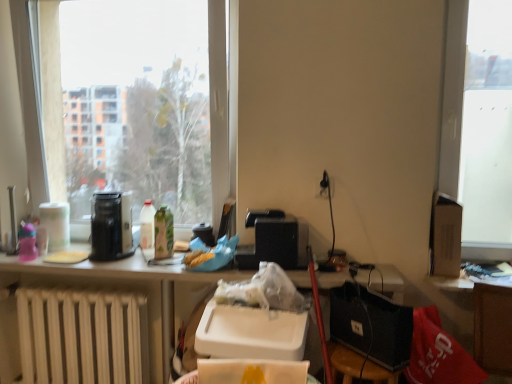
What do you see at coordinates (111, 226) in the screenshot? This screenshot has width=512, height=384. I see `matte black coffee maker at left, which ranks as the 2th appliance in right-to-left order` at bounding box center [111, 226].

Where is `green matte bottle at center, which appears as the 2th bottle when viewed from the left`? Image resolution: width=512 pixels, height=384 pixels. green matte bottle at center, which appears as the 2th bottle when viewed from the left is located at coordinates (163, 233).

Find the location of a particular element. This screenshot has height=384, width=512. wooden stool at lower right is located at coordinates (389, 330).

The height and width of the screenshot is (384, 512). In order to click on matte black coffee maker at center, which is counted as the second appliance, starting from the left in this screenshot , I will do `click(204, 234)`.

The width and height of the screenshot is (512, 384). In order to click on matte cardboard box at upper right in this screenshot , I will do click(445, 236).

The width and height of the screenshot is (512, 384). What do you see at coordinates (147, 225) in the screenshot?
I see `white glossy bottle at center, positioned as the 1th bottle in left-to-right order` at bounding box center [147, 225].

Locate an element on the screen. The height and width of the screenshot is (384, 512). matte black coffee maker at left, positioned as the first appliance in left-to-right order is located at coordinates (111, 226).

Between black plastic speaker at center and white matte radiator at lower left, which one has more height?

Standing taller between the two is white matte radiator at lower left.

How distant is black plastic speaker at center from white matte radiator at lower left?

36.17 inches.

From the image's perspective, which is above, black plastic speaker at center or white matte radiator at lower left?

From the image's view, black plastic speaker at center is above.

Is black plastic speaker at center positioned in front of white matte radiator at lower left?

That is True.

Who is bigger, matte black coffee maker at left, positioned as the first appliance in left-to-right order, or white matte radiator at lower left?

white matte radiator at lower left is bigger.

Considering the sizes of matte black coffee maker at left, which ranks as the 2th appliance in right-to-left order, and white matte radiator at lower left in the image, is matte black coffee maker at left, which ranks as the 2th appliance in right-to-left order, wider or thinner than white matte radiator at lower left?

Considering their sizes, matte black coffee maker at left, which ranks as the 2th appliance in right-to-left order, looks broader than white matte radiator at lower left.

Considering the points (130, 231) and (125, 295), which point is behind, point (130, 231) or point (125, 295)?

The point (130, 231) is more distant.

Does matte black coffee maker at left, positioned as the first appliance in left-to-right order, have a greater height compared to white matte radiator at lower left?

No, matte black coffee maker at left, positioned as the first appliance in left-to-right order, is not taller than white matte radiator at lower left.

Is wooden stool at lower right to the left of black plastic speaker at center from the viewer's perspective?

No, wooden stool at lower right is not to the left of black plastic speaker at center.

How many degrees apart are the facing directions of wooden stool at lower right and black plastic speaker at center?

wooden stool at lower right and black plastic speaker at center are facing 1.95 degrees away from each other.

From a real-world perspective, is wooden stool at lower right positioned above or below black plastic speaker at center?

Clearly, from a real-world perspective, wooden stool at lower right is below black plastic speaker at center.

Is wooden stool at lower right facing away from black plastic speaker at center?

wooden stool at lower right does not have its back to black plastic speaker at center.

From the image's perspective, which is above, black plastic speaker at center or wooden stool at lower right?

black plastic speaker at center appears higher in the image.

Consider the image. From a real-world perspective, is black plastic speaker at center over wooden stool at lower right?

Yes.

Is wooden stool at lower right inside black plastic speaker at center?

No, wooden stool at lower right is not surrounded by black plastic speaker at center.

Image resolution: width=512 pixels, height=384 pixels. I want to click on chair that appears on the right of black plastic speaker at center, so point(389,330).

Is transparent glass window at upper left wider than white matte radiator at lower left?

Yes.

Which of these two, transparent glass window at upper left or white matte radiator at lower left, is smaller?

With smaller size is white matte radiator at lower left.

Locate an element on the screen. radiator that is under the transparent glass window at upper left (from a real-world perspective) is located at coordinates [x=82, y=337].

Looking at this image, is transparent glass window at upper left in contact with white matte radiator at lower left?

No, transparent glass window at upper left is not touching white matte radiator at lower left.

Measure the distance from wooden stool at lower right to matte black coffee maker at left, positioned as the first appliance in left-to-right order.

wooden stool at lower right and matte black coffee maker at left, positioned as the first appliance in left-to-right order, are 3.60 feet apart.

Based on the photo, can you tell me how much wooden stool at lower right and matte black coffee maker at left, which ranks as the 2th appliance in right-to-left order, differ in facing direction?

There is a 1.46-degree angle between the facing directions of wooden stool at lower right and matte black coffee maker at left, which ranks as the 2th appliance in right-to-left order.

Is point (361, 305) positioned after point (99, 226)?

That is False.

From a real-world perspective, is wooden stool at lower right positioned above or below matte black coffee maker at left, which ranks as the 2th appliance in right-to-left order?

wooden stool at lower right is situated lower than matte black coffee maker at left, which ranks as the 2th appliance in right-to-left order, in the real world.

Is matte black coffee maker at left, which ranks as the 2th appliance in right-to-left order, looking in the opposite direction of wooden stool at lower right?

That's not correct — matte black coffee maker at left, which ranks as the 2th appliance in right-to-left order, is not looking away from wooden stool at lower right.

Identify the location of chair that is under the matte black coffee maker at left, which ranks as the 2th appliance in right-to-left order (from a real-world perspective). (389, 330).

Which object is positioned more to the right, matte black coffee maker at left, which ranks as the 2th appliance in right-to-left order, or wooden stool at lower right?

wooden stool at lower right.

The width and height of the screenshot is (512, 384). What are the coordinates of `radiator below the black plastic speaker at center (from a real-world perspective)` in the screenshot? It's located at (82, 337).

At what (x,y) coordinates should I click in order to perform the action: click on appliance in front of the white matte radiator at lower left. Please return your answer as a coordinate pair (x, y). Looking at the image, I should click on (111, 226).

Looking at the image, which one is located closer to black plastic speaker at center, white glossy bottle at center, positioned as the 1th bottle in left-to-right order, or matte black coffee maker at center, which is the first appliance in right-to-left order?

matte black coffee maker at center, which is the first appliance in right-to-left order, is positioned closer to the anchor black plastic speaker at center.

Estimate the real-world distances between objects in this image. Which object is further from matte black coffee maker at center, which is the first appliance in right-to-left order, wooden stool at lower right or green matte bottle at center, which appears as the 2th bottle when viewed from the left?

wooden stool at lower right is positioned further to the anchor matte black coffee maker at center, which is the first appliance in right-to-left order.

Looking at the image, which one is located closer to white matte radiator at lower left, matte black coffee maker at left, positioned as the first appliance in left-to-right order, or matte black coffee maker at center, which is the first appliance in right-to-left order?

Among the two, matte black coffee maker at left, positioned as the first appliance in left-to-right order, is located nearer to white matte radiator at lower left.

When comparing their distances from wooden stool at lower right, does transparent glass window at upper left or green matte bottle at center, which appears as the 2th bottle when viewed from the left, seem further?

transparent glass window at upper left.

From the picture: Which object lies further to the anchor point matte black coffee maker at center, which is counted as the second appliance, starting from the left, white glossy bottle at center, placed as the second bottle when sorted from right to left, or green matte bottle at center, the first bottle viewed from the right?

white glossy bottle at center, placed as the second bottle when sorted from right to left, lies further to matte black coffee maker at center, which is counted as the second appliance, starting from the left, than the other object.

From the image, which object appears to be farther from wooden stool at lower right, white matte radiator at lower left or matte cardboard box at upper right?

white matte radiator at lower left.

Based on their spatial positions, is white matte radiator at lower left or white glossy bottle at center, placed as the second bottle when sorted from right to left, further from matte black coffee maker at left, which ranks as the 2th appliance in right-to-left order?

white matte radiator at lower left lies further to matte black coffee maker at left, which ranks as the 2th appliance in right-to-left order, than the other object.

From the image, which object appears to be nearer to matte black coffee maker at left, positioned as the first appliance in left-to-right order, white matte radiator at lower left or matte black coffee maker at center, which is counted as the second appliance, starting from the left?

matte black coffee maker at center, which is counted as the second appliance, starting from the left, is positioned closer to the anchor matte black coffee maker at left, positioned as the first appliance in left-to-right order.

The height and width of the screenshot is (384, 512). In order to click on loudspeaker between white matte radiator at lower left and wooden stool at lower right in this screenshot , I will do `click(282, 241)`.

The width and height of the screenshot is (512, 384). I want to click on loudspeaker between transparent glass window at upper left and matte cardboard box at upper right in the horizontal direction, so click(x=282, y=241).

Find the location of a particular element. chair between white glossy bottle at center, positioned as the 1th bottle in left-to-right order, and matte cardboard box at upper right, in the horizontal direction is located at coordinates (389, 330).

The height and width of the screenshot is (384, 512). Identify the location of appliance situated between green matte bottle at center, which appears as the 2th bottle when viewed from the left, and wooden stool at lower right from left to right. (204, 234).